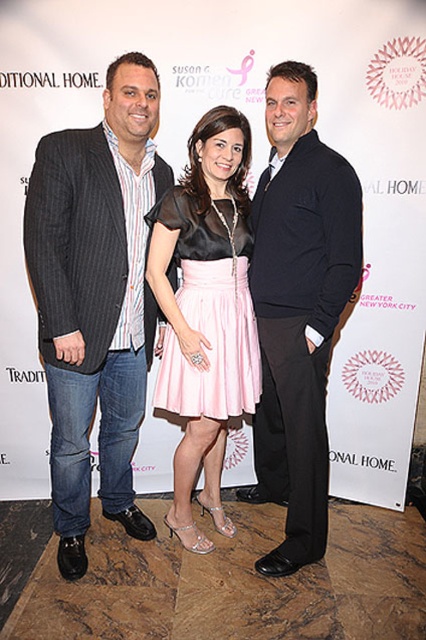
Based on the scene described, which object is located below the other between the striped cotton shirt at left and the pink satin skirt at center?

The striped cotton shirt at left is positioned under the pink satin skirt at center, meaning it is located below the pink satin skirt at center.

Based on the scene description, which clothing item is larger in size between the striped cotton shirt at left and the dark blue sweater at center?

The striped cotton shirt at left is bigger than the dark blue sweater at center.

You are a photographer at the event and need to adjust the lighting so that both the dark blue sweater at center and the pink satin skirt at center are equally illuminated. Given their current positions, is there enough space between them to place a reflector between them without moving either garment?

The distance between the dark blue sweater at center and the pink satin skirt at center is 25.41 centimeters. A reflector typically requires about 20 centimeters of space to function effectively. Therefore, there is sufficient space to place the reflector between them without moving either garment.